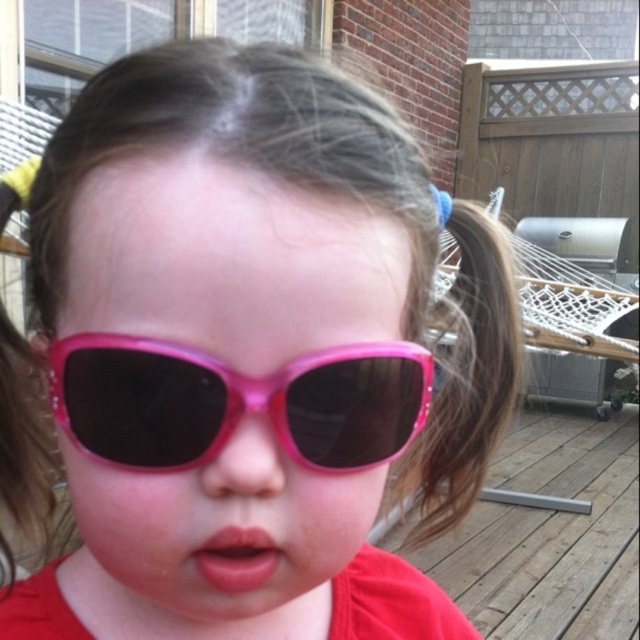
Question: Among these objects, which one is farthest from the camera?

Choices:
 (A) pink plastic sunglasses at center
 (B) pink glossy lips at center

Answer: (B)

Question: From the image, what is the correct spatial relationship of pink plastic sunglasses at center in relation to pink glossy lips at center?

Choices:
 (A) below
 (B) above

Answer: (B)

Question: In this image, where is pink plastic sunglasses at center located relative to pink glossy lips at center?

Choices:
 (A) below
 (B) above

Answer: (B)

Question: Can you confirm if pink plastic sunglasses at center is bigger than pink glossy lips at center?

Choices:
 (A) no
 (B) yes

Answer: (B)